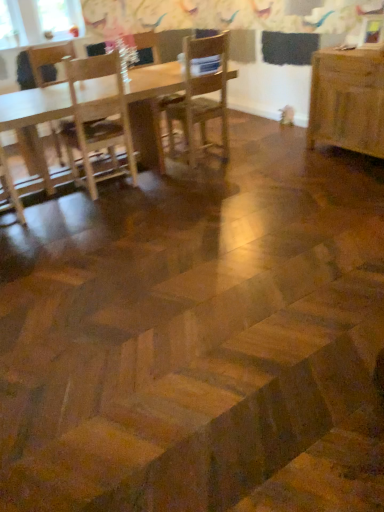
What do you see at coordinates (60, 17) in the screenshot?
I see `clear glass window screen at upper left` at bounding box center [60, 17].

What do you see at coordinates (201, 94) in the screenshot? I see `wooden chair at center, acting as the first chair starting from the right` at bounding box center [201, 94].

What are the coordinates of `clear glass window screen at upper left` in the screenshot? It's located at (60, 17).

Is wooden table at upper left, placed as the second table when sorted from right to left, looking in the opposite direction of wooden table at right, acting as the 2th table starting from the left?

That's not correct — wooden table at upper left, placed as the second table when sorted from right to left, is not looking away from wooden table at right, acting as the 2th table starting from the left.

Is wooden table at upper left, placed as the second table when sorted from right to left, at the left side of wooden table at right, which is the 1th table in right-to-left order?

Yes.

Would you say wooden table at right, which is the 1th table in right-to-left order, is part of wooden table at upper left, placed as the second table when sorted from right to left,'s contents?

No.

Locate an element on the screen. table on the right of the wooden table at upper left, the 1th table in the left-to-right sequence is located at coordinates (347, 100).

Considering the sizes of objects wooden table at upper left, placed as the second table when sorted from right to left, and light brown wooden chair at left, which is the third chair in right-to-left order, in the image provided, who is thinner, wooden table at upper left, placed as the second table when sorted from right to left, or light brown wooden chair at left, which is the third chair in right-to-left order,?

Thinner between the two is light brown wooden chair at left, which is the third chair in right-to-left order.

From their relative heights in the image, would you say wooden table at upper left, the 1th table in the left-to-right sequence, is taller or shorter than light brown wooden chair at left, arranged as the 1th chair when viewed from the left?

Clearly, wooden table at upper left, the 1th table in the left-to-right sequence, is shorter compared to light brown wooden chair at left, arranged as the 1th chair when viewed from the left.

Can you confirm if wooden table at upper left, placed as the second table when sorted from right to left, is smaller than light brown wooden chair at left, which is the third chair in right-to-left order?

Actually, wooden table at upper left, placed as the second table when sorted from right to left, might be larger than light brown wooden chair at left, which is the third chair in right-to-left order.

Are wooden table at upper left, placed as the second table when sorted from right to left, and light brown wooden chair at left, which is the third chair in right-to-left order, making contact?

wooden table at upper left, placed as the second table when sorted from right to left, is not next to light brown wooden chair at left, which is the third chair in right-to-left order, and they're not touching.

Is there a large distance between wooden chair at center, which ranks as the second chair in right-to-left order, and wooden table at right, acting as the 2th table starting from the left?

Yes, wooden chair at center, which ranks as the second chair in right-to-left order, and wooden table at right, acting as the 2th table starting from the left, are located far from each other.

Is wooden chair at center, which ranks as the second chair in right-to-left order, aimed at wooden table at right, acting as the 2th table starting from the left?

No.

Does wooden chair at center, which ranks as the second chair in right-to-left order, come behind wooden table at right, which is the 1th table in right-to-left order?

Yes, wooden chair at center, which ranks as the second chair in right-to-left order, is further from the camera.

Does wooden chair at center, positioned as the 2th chair in left-to-right order, have a smaller size compared to wooden table at right, acting as the 2th table starting from the left?

Indeed, wooden chair at center, positioned as the 2th chair in left-to-right order, has a smaller size compared to wooden table at right, acting as the 2th table starting from the left.

In the scene shown: Considering the sizes of objects wooden table at upper left, the 1th table in the left-to-right sequence, and clear glass window screen at upper left in the image provided, who is thinner, wooden table at upper left, the 1th table in the left-to-right sequence, or clear glass window screen at upper left?

clear glass window screen at upper left.

Which object is further away from the camera taking this photo, wooden table at upper left, placed as the second table when sorted from right to left, or clear glass window screen at upper left?

clear glass window screen at upper left is further from the camera.

How distant is wooden table at upper left, the 1th table in the left-to-right sequence, from clear glass window screen at upper left?

wooden table at upper left, the 1th table in the left-to-right sequence, is 1.13 meters away from clear glass window screen at upper left.

Considering the sizes of objects wooden table at upper left, the 1th table in the left-to-right sequence, and clear glass window screen at upper left in the image provided, who is bigger, wooden table at upper left, the 1th table in the left-to-right sequence, or clear glass window screen at upper left?

wooden table at upper left, the 1th table in the left-to-right sequence, is bigger.

Is light brown wooden chair at left, which is the third chair in right-to-left order, turned away from wooden chair at center, acting as the first chair starting from the right?

No, light brown wooden chair at left, which is the third chair in right-to-left order, is not facing away from wooden chair at center, acting as the first chair starting from the right.

Is light brown wooden chair at left, arranged as the 1th chair when viewed from the left, not near wooden chair at center, which is counted as the third chair, starting from the left?

Yes, light brown wooden chair at left, arranged as the 1th chair when viewed from the left, and wooden chair at center, which is counted as the third chair, starting from the left, are located far from each other.

Considering the relative positions of light brown wooden chair at left, arranged as the 1th chair when viewed from the left, and wooden chair at center, acting as the first chair starting from the right, in the image provided, is light brown wooden chair at left, arranged as the 1th chair when viewed from the left, behind wooden chair at center, acting as the first chair starting from the right,?

Yes, the depth of light brown wooden chair at left, arranged as the 1th chair when viewed from the left, is greater than that of wooden chair at center, acting as the first chair starting from the right.

Between light brown wooden chair at left, which is the third chair in right-to-left order, and wooden chair at center, which is counted as the third chair, starting from the left, which one has less height?

With less height is light brown wooden chair at left, which is the third chair in right-to-left order.

From a real-world perspective, is wooden table at right, which is the 1th table in right-to-left order, positioned under wooden chair at center, which ranks as the second chair in right-to-left order, based on gravity?

Indeed, from a real-world perspective, wooden table at right, which is the 1th table in right-to-left order, is positioned beneath wooden chair at center, which ranks as the second chair in right-to-left order.

Does wooden table at right, acting as the 2th table starting from the left, turn towards wooden chair at center, positioned as the 2th chair in left-to-right order?

No, wooden table at right, acting as the 2th table starting from the left, is not oriented towards wooden chair at center, positioned as the 2th chair in left-to-right order.

Are wooden table at right, acting as the 2th table starting from the left, and wooden chair at center, positioned as the 2th chair in left-to-right order, beside each other?

No, wooden table at right, acting as the 2th table starting from the left, is not in contact with wooden chair at center, positioned as the 2th chair in left-to-right order.

Can you tell me how much wooden table at right, acting as the 2th table starting from the left, and wooden chair at center, positioned as the 2th chair in left-to-right order, differ in facing direction?

The angle between the facing direction of wooden table at right, acting as the 2th table starting from the left, and the facing direction of wooden chair at center, positioned as the 2th chair in left-to-right order, is 84.3 degrees.

Considering the sizes of objects wooden chair at center, positioned as the 2th chair in left-to-right order, and wooden table at upper left, placed as the second table when sorted from right to left, in the image provided, who is smaller, wooden chair at center, positioned as the 2th chair in left-to-right order, or wooden table at upper left, placed as the second table when sorted from right to left,?

With smaller size is wooden chair at center, positioned as the 2th chair in left-to-right order.

Can you tell me how much wooden chair at center, which ranks as the second chair in right-to-left order, and wooden table at upper left, the 1th table in the left-to-right sequence, differ in facing direction?

They differ by 5.11 degrees in their facing directions.

Does wooden chair at center, which ranks as the second chair in right-to-left order, touch wooden table at upper left, placed as the second table when sorted from right to left?

There is a gap between wooden chair at center, which ranks as the second chair in right-to-left order, and wooden table at upper left, placed as the second table when sorted from right to left.

Does point (138, 42) lie in front of point (42, 173)?

No, (138, 42) is behind (42, 173).

The height and width of the screenshot is (512, 384). I want to click on table in front of the wooden table at right, which is the 1th table in right-to-left order, so click(x=35, y=117).

What are the coordinates of `the 1st chair positioned above the wooden table at upper left, placed as the second table when sorted from right to left (from the image's perspective)` in the screenshot? It's located at (48, 62).

Looking at the image, which one is located closer to wooden chair at center, positioned as the 2th chair in left-to-right order, wooden chair at center, acting as the first chair starting from the right, or light brown wooden chair at left, arranged as the 1th chair when viewed from the left?

wooden chair at center, acting as the first chair starting from the right.

Consider the image. From the image, which object appears to be farther from wooden chair at center, which is counted as the third chair, starting from the left, wooden table at upper left, the 1th table in the left-to-right sequence, or clear glass window screen at upper left?

clear glass window screen at upper left is positioned further to the anchor wooden chair at center, which is counted as the third chair, starting from the left.

Looking at the image, which one is located further to wooden table at right, which is the 1th table in right-to-left order, wooden table at upper left, the 1th table in the left-to-right sequence, or wooden chair at center, which ranks as the second chair in right-to-left order?

wooden table at upper left, the 1th table in the left-to-right sequence.

In the scene shown: Looking at the image, which one is located further to clear glass window screen at upper left, light brown wooden chair at left, arranged as the 1th chair when viewed from the left, or wooden chair at center, positioned as the 2th chair in left-to-right order?

The object further to clear glass window screen at upper left is wooden chair at center, positioned as the 2th chair in left-to-right order.

Considering their positions, is wooden table at right, acting as the 2th table starting from the left, positioned further to wooden chair at center, positioned as the 2th chair in left-to-right order, than wooden table at upper left, placed as the second table when sorted from right to left?

wooden table at right, acting as the 2th table starting from the left, is further to wooden chair at center, positioned as the 2th chair in left-to-right order.

Based on their spatial positions, is wooden chair at center, positioned as the 2th chair in left-to-right order, or light brown wooden chair at left, arranged as the 1th chair when viewed from the left, further from wooden table at upper left, placed as the second table when sorted from right to left?

light brown wooden chair at left, arranged as the 1th chair when viewed from the left, lies further to wooden table at upper left, placed as the second table when sorted from right to left, than the other object.

Which object lies further to the anchor point wooden table at upper left, the 1th table in the left-to-right sequence, clear glass window screen at upper left or wooden chair at center, positioned as the 2th chair in left-to-right order?

clear glass window screen at upper left.

Estimate the real-world distances between objects in this image. Which object is closer to wooden chair at center, positioned as the 2th chair in left-to-right order, light brown wooden chair at left, which is the third chair in right-to-left order, or wooden chair at center, which is counted as the third chair, starting from the left?

wooden chair at center, which is counted as the third chair, starting from the left.

Find the location of a particular element. The image size is (384, 512). chair between wooden chair at center, positioned as the 2th chair in left-to-right order, and wooden table at right, which is the 1th table in right-to-left order, in the horizontal direction is located at coordinates (201, 94).

In order to click on table between light brown wooden chair at left, arranged as the 1th chair when viewed from the left, and wooden chair at center, acting as the first chair starting from the right in this screenshot , I will do `click(35, 117)`.

Find the location of a particular element. The width and height of the screenshot is (384, 512). table between clear glass window screen at upper left and wooden table at right, acting as the 2th table starting from the left, in the horizontal direction is located at coordinates (35, 117).

Locate an element on the screen. The width and height of the screenshot is (384, 512). chair situated between light brown wooden chair at left, arranged as the 1th chair when viewed from the left, and wooden chair at center, acting as the first chair starting from the right, from left to right is located at coordinates (150, 129).